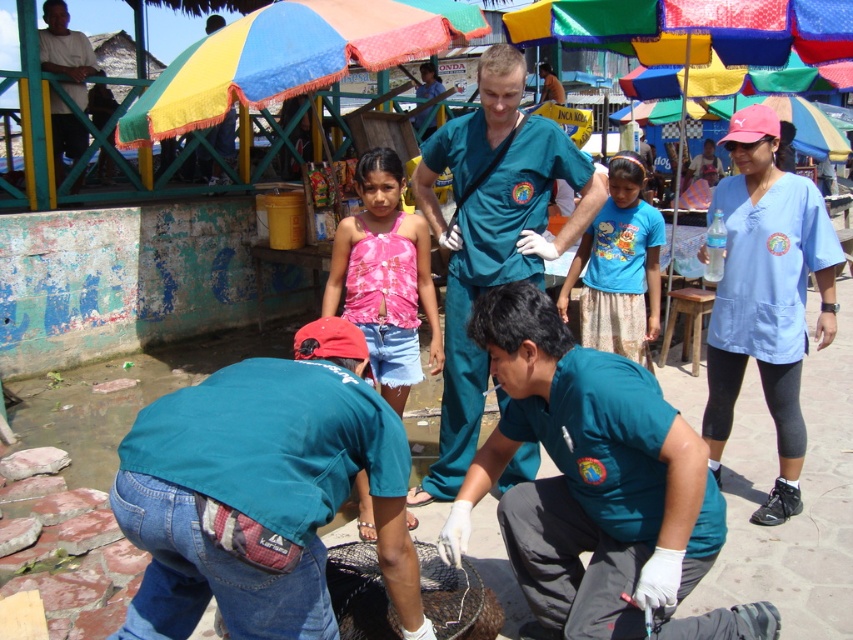
Question: Based on their relative distances, which object is farther from the pink fabric top at center?

Choices:
 (A) teal uniform at center
 (B) multicolored fabric umbrella at upper center
 (C) teal scrubs at center

Answer: (B)

Question: Which point is farther to the camera?

Choices:
 (A) (637, 211)
 (B) (186, 536)
 (C) (767, 620)
 (D) (56, 36)

Answer: (D)

Question: Which of the following is the farthest from the observer?

Choices:
 (A) (44, 42)
 (B) (265, 54)

Answer: (A)

Question: Does teal fabric shirt at lower left have a larger size compared to teal uniform at center?

Choices:
 (A) no
 (B) yes

Answer: (A)

Question: Observing the image, what is the correct spatial positioning of teal uniform at center in reference to pink fabric top at center?

Choices:
 (A) below
 (B) above

Answer: (A)

Question: Can you confirm if teal scrubs at center is thinner than blue cotton shirt at center?

Choices:
 (A) no
 (B) yes

Answer: (A)